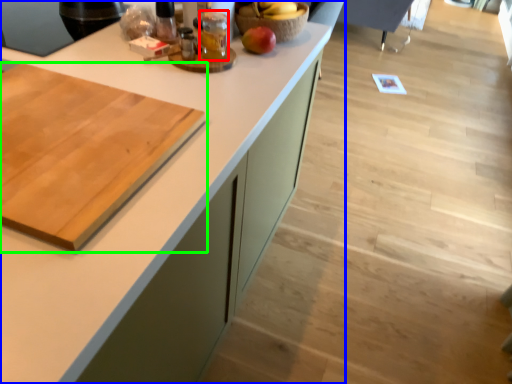
Question: Based on their relative distances, which object is farther from beverage (highlighted by a red box)? Choose from countertop (highlighted by a blue box) and cutting board (highlighted by a green box).

Choices:
 (A) countertop
 (B) cutting board

Answer: (B)